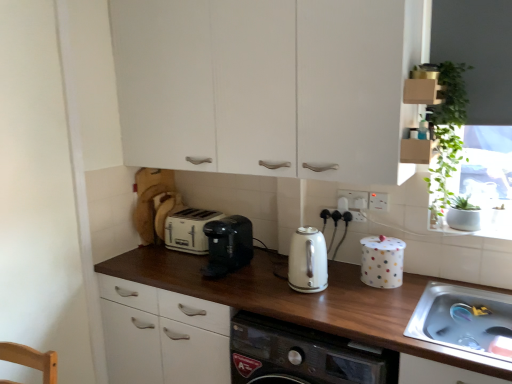
Question: Is stainless steel sink at lower right wider or thinner than white matte cabinet at upper center?

Choices:
 (A) thin
 (B) wide

Answer: (B)

Question: Considering the positions of stainless steel sink at lower right and white matte cabinet at upper center in the image, is stainless steel sink at lower right bigger or smaller than white matte cabinet at upper center?

Choices:
 (A) big
 (B) small

Answer: (B)

Question: Estimate the real-world distances between objects in this image. Which object is closer to the white matte cabinet at upper center?

Choices:
 (A) white plastic socket at upper center, the 2th electric outlet in the right-to-left sequence
 (B) white polka dot canister at right
 (C) white plastic toaster at center
 (D) white glossy kettle at center, positioned as the 1th kitchen appliance in right-to-left order
 (E) stainless steel sink at lower right

Answer: (D)

Question: Estimate the real-world distances between objects in this image. Which object is closer to the green leafy plant at upper right?

Choices:
 (A) brown wood countertop at center
 (B) white plastic electrical outlet at upper center, the first electric outlet from the right
 (C) white plastic socket at upper center, the 2th electric outlet in the right-to-left sequence
 (D) white plastic toaster at center
 (E) stainless steel sink at lower right

Answer: (B)